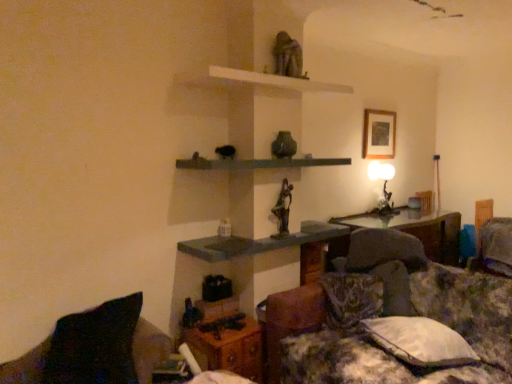
Where is `green concrete shelf at center, marked as the second shelf in a bottom-to-top arrangement`? green concrete shelf at center, marked as the second shelf in a bottom-to-top arrangement is located at coordinates (257, 163).

At what (x,y) coordinates should I click in order to perform the action: click on matte gray stone statue at upper center, which appears as the second sculpture when ordered from the bottom. Please return your answer as a coordinate pair (x, y). This screenshot has width=512, height=384. Looking at the image, I should click on (287, 56).

Where is `fluffy fabric couch at lower right`? This screenshot has height=384, width=512. fluffy fabric couch at lower right is located at coordinates (404, 321).

Which is more to the right, matte gray shelf at center, the 3th shelf when ordered from top to bottom, or bronze statue at center, placed as the second sculpture when sorted from top to bottom?

bronze statue at center, placed as the second sculpture when sorted from top to bottom, is more to the right.

From the image's perspective, is matte gray shelf at center, the 3th shelf when ordered from top to bottom, above or below bronze statue at center, positioned as the 1th sculpture in bottom-to-top order?

matte gray shelf at center, the 3th shelf when ordered from top to bottom, is situated lower than bronze statue at center, positioned as the 1th sculpture in bottom-to-top order, in the image.

Between point (229, 246) and point (273, 209), which one is positioned in front?

Positioned in front is point (229, 246).

From the image's perspective, between wooden picture frame at upper center and matte black table lamp at upper right, which one is located above?

wooden picture frame at upper center appears higher in the image.

Does wooden picture frame at upper center touch matte black table lamp at upper right?

No, wooden picture frame at upper center is not in contact with matte black table lamp at upper right.

From a real-world perspective, between wooden picture frame at upper center and matte black table lamp at upper right, who is vertically higher?

wooden picture frame at upper center.

Is wooden picture frame at upper center positioned behind matte black table lamp at upper right?

No, it is not.

Considering the sizes of objects matte black table lamp at upper right and matte gray shelf at center, which is the 1th shelf in bottom-to-top order, in the image provided, who is thinner, matte black table lamp at upper right or matte gray shelf at center, which is the 1th shelf in bottom-to-top order,?

Thinner between the two is matte black table lamp at upper right.

Is matte black table lamp at upper right oriented towards matte gray shelf at center, which is the 1th shelf in bottom-to-top order?

No.

Considering the positions of objects matte black table lamp at upper right and matte gray shelf at center, which is the 1th shelf in bottom-to-top order, in the image provided, who is in front, matte black table lamp at upper right or matte gray shelf at center, which is the 1th shelf in bottom-to-top order,?

matte gray shelf at center, which is the 1th shelf in bottom-to-top order, is more forward.

Consider the image. Who is bigger, matte black table lamp at upper right or matte gray shelf at center, the 3th shelf when ordered from top to bottom?

matte gray shelf at center, the 3th shelf when ordered from top to bottom.

Which object is further away from the camera, matte gray stone statue at upper center, the first sculpture viewed from the top, or white fabric pillow at lower right, which is the 2th pillow in right-to-left order?

matte gray stone statue at upper center, the first sculpture viewed from the top, is further away from the camera.

Who is shorter, matte gray stone statue at upper center, which appears as the second sculpture when ordered from the bottom, or white fabric pillow at lower right, which ranks as the 2th pillow in back-to-front order?

white fabric pillow at lower right, which ranks as the 2th pillow in back-to-front order.

In the scene shown: From a real-world perspective, relative to white fabric pillow at lower right, which is the 2th pillow in right-to-left order, is matte gray stone statue at upper center, the first sculpture viewed from the top, vertically above or below?

From a real-world perspective, matte gray stone statue at upper center, the first sculpture viewed from the top, is physically above white fabric pillow at lower right, which is the 2th pillow in right-to-left order.

Who is smaller, matte gray stone statue at upper center, which appears as the second sculpture when ordered from the bottom, or white fabric pillow at lower right, the second pillow positioned from the front?

matte gray stone statue at upper center, which appears as the second sculpture when ordered from the bottom, is smaller.

From a real-world perspective, is bronze statue at center, placed as the second sculpture when sorted from top to bottom, located higher than matte gray stone statue at upper center, the first sculpture viewed from the top?

No, from a real-world perspective, bronze statue at center, placed as the second sculpture when sorted from top to bottom, is not over matte gray stone statue at upper center, the first sculpture viewed from the top

From the image's perspective, is bronze statue at center, placed as the second sculpture when sorted from top to bottom, over matte gray stone statue at upper center, which appears as the second sculpture when ordered from the bottom?

No, from the image's perspective, bronze statue at center, placed as the second sculpture when sorted from top to bottom, is not on top of matte gray stone statue at upper center, which appears as the second sculpture when ordered from the bottom.

Would you say matte gray stone statue at upper center, which appears as the second sculpture when ordered from the bottom, is part of bronze statue at center, placed as the second sculpture when sorted from top to bottom,'s contents?

That's incorrect, matte gray stone statue at upper center, which appears as the second sculpture when ordered from the bottom, is not inside bronze statue at center, placed as the second sculpture when sorted from top to bottom.

Which point is more forward, (279, 230) or (290, 43)?

The point (290, 43) is closer to the camera.

Can you tell me how much fluffy fabric pillow at lower right, acting as the 3th pillow starting from the front, and fluffy fabric couch at lower right differ in facing direction?

The angle between the facing direction of fluffy fabric pillow at lower right, acting as the 3th pillow starting from the front, and the facing direction of fluffy fabric couch at lower right is 83.8 degrees.

Is fluffy fabric pillow at lower right, the 1th pillow viewed from the right, oriented towards fluffy fabric couch at lower right?

No, fluffy fabric pillow at lower right, the 1th pillow viewed from the right, is not turned towards fluffy fabric couch at lower right.

Is fluffy fabric pillow at lower right, acting as the 3th pillow starting from the front, at the left side of fluffy fabric couch at lower right?

No.

Identify the location of the 2nd pillow above the fluffy fabric couch at lower right (from the image's perspective). This screenshot has height=384, width=512. (496, 245).

Considering the sizes of objects fluffy fabric pillow at lower right, acting as the 3th pillow starting from the front, and wooden picture frame at upper center in the image provided, who is shorter, fluffy fabric pillow at lower right, acting as the 3th pillow starting from the front, or wooden picture frame at upper center?

fluffy fabric pillow at lower right, acting as the 3th pillow starting from the front, is shorter.

Considering the relative positions of fluffy fabric pillow at lower right, arranged as the 1th pillow when viewed from the back, and wooden picture frame at upper center in the image provided, is fluffy fabric pillow at lower right, arranged as the 1th pillow when viewed from the back, to the left or to the right of wooden picture frame at upper center?

From the image, it's evident that fluffy fabric pillow at lower right, arranged as the 1th pillow when viewed from the back, is to the right of wooden picture frame at upper center.

Based on the photo, is fluffy fabric pillow at lower right, arranged as the 1th pillow when viewed from the back, oriented towards wooden picture frame at upper center?

No.

Is fluffy fabric pillow at lower right, arranged as the 1th pillow when viewed from the back, positioned in front of wooden picture frame at upper center?

Yes, fluffy fabric pillow at lower right, arranged as the 1th pillow when viewed from the back, is in front of wooden picture frame at upper center.

The width and height of the screenshot is (512, 384). In order to click on the 2nd sculpture behind when counting from the matte gray shelf at center, the 3th shelf when ordered from top to bottom in this screenshot , I will do `click(283, 209)`.

Locate an element on the screen. table lamp that appears below the wooden picture frame at upper center (from the image's perspective) is located at coordinates (383, 185).

Looking at this image, estimate the real-world distances between objects in this image. Which object is closer to white fabric pillow at lower right, which ranks as the 2th pillow in back-to-front order, matte black table lamp at upper right or matte gray shelf at center, the 3th shelf when ordered from top to bottom?

The object closer to white fabric pillow at lower right, which ranks as the 2th pillow in back-to-front order, is matte gray shelf at center, the 3th shelf when ordered from top to bottom.

Based on their spatial positions, is green concrete shelf at center, the second shelf when ordered from top to bottom, or white fabric pillow at lower right, which is the 2th pillow in right-to-left order, closer to black fabric pillow at lower left, the first pillow from the front?

green concrete shelf at center, the second shelf when ordered from top to bottom.

Which object lies further to the anchor point white fabric pillow at lower right, which is the 2th pillow in right-to-left order, fluffy fabric pillow at lower right, arranged as the 1th pillow when viewed from the back, or transparent glass table at center, the first table in the right-to-left sequence?

The object further to white fabric pillow at lower right, which is the 2th pillow in right-to-left order, is fluffy fabric pillow at lower right, arranged as the 1th pillow when viewed from the back.

From the picture: Considering their positions, is black fabric pillow at lower left, which is the third pillow in back-to-front order, positioned closer to white fabric pillow at lower right, which ranks as the 2th pillow in back-to-front order, than matte gray shelf at center, the 3th shelf when ordered from top to bottom?

The object closer to white fabric pillow at lower right, which ranks as the 2th pillow in back-to-front order, is matte gray shelf at center, the 3th shelf when ordered from top to bottom.

From the picture: Considering their positions, is transparent glass table at center, the first table in the right-to-left sequence, positioned further to black fabric pillow at lower left, the first pillow from the front, than wooden table at lower center, the first table positioned from the bottom?

transparent glass table at center, the first table in the right-to-left sequence, is positioned further to the anchor black fabric pillow at lower left, the first pillow from the front.

Based on their spatial positions, is white fabric pillow at lower right, the second pillow positioned from the front, or bronze statue at center, placed as the second sculpture when sorted from top to bottom, further from fluffy fabric couch at lower right?

The object further to fluffy fabric couch at lower right is bronze statue at center, placed as the second sculpture when sorted from top to bottom.

Looking at the image, which one is located further to green concrete shelf at center, marked as the second shelf in a bottom-to-top arrangement, transparent glass table at center, the first table in the right-to-left sequence, or wooden picture frame at upper center?

Based on the image, transparent glass table at center, the first table in the right-to-left sequence, appears to be further to green concrete shelf at center, marked as the second shelf in a bottom-to-top arrangement.

Looking at the image, which one is located closer to wooden table at lower center, which is the 1th table in left-to-right order, matte gray shelf at center, the 3th shelf when ordered from top to bottom, or bronze statue at center, placed as the second sculpture when sorted from top to bottom?

matte gray shelf at center, the 3th shelf when ordered from top to bottom, lies closer to wooden table at lower center, which is the 1th table in left-to-right order, than the other object.

Find the location of a particular element. shelf between white matte shelf at upper center, positioned as the first shelf in top-to-bottom order, and matte gray shelf at center, which is the 1th shelf in bottom-to-top order, vertically is located at coordinates (257, 163).

Where is `table between matte gray shelf at center, which is the 1th shelf in bottom-to-top order, and fluffy fabric pillow at lower right, the 1th pillow viewed from the right, in the horizontal direction`? The width and height of the screenshot is (512, 384). table between matte gray shelf at center, which is the 1th shelf in bottom-to-top order, and fluffy fabric pillow at lower right, the 1th pillow viewed from the right, in the horizontal direction is located at coordinates (417, 230).

Locate an element on the screen. This screenshot has width=512, height=384. couch situated between white matte shelf at upper center, positioned as the first shelf in top-to-bottom order, and fluffy fabric pillow at lower right, the 3th pillow in the left-to-right sequence, from left to right is located at coordinates coord(404,321).

Where is `table between black fabric pillow at lower left, the 1th pillow positioned from the left, and transparent glass table at center, the first table in the right-to-left sequence`? table between black fabric pillow at lower left, the 1th pillow positioned from the left, and transparent glass table at center, the first table in the right-to-left sequence is located at coordinates (229, 349).